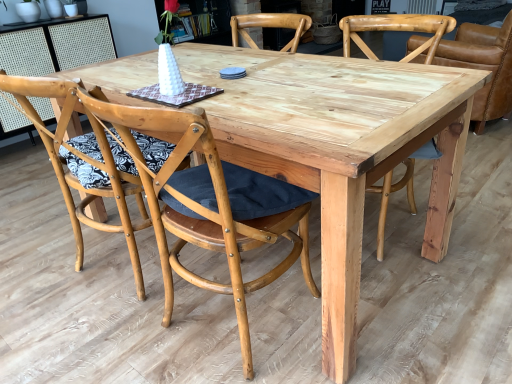
I want to click on free area below natural wood chair at center, which is the 4th chair in right-to-left order (from a real-world perspective), so click(116, 274).